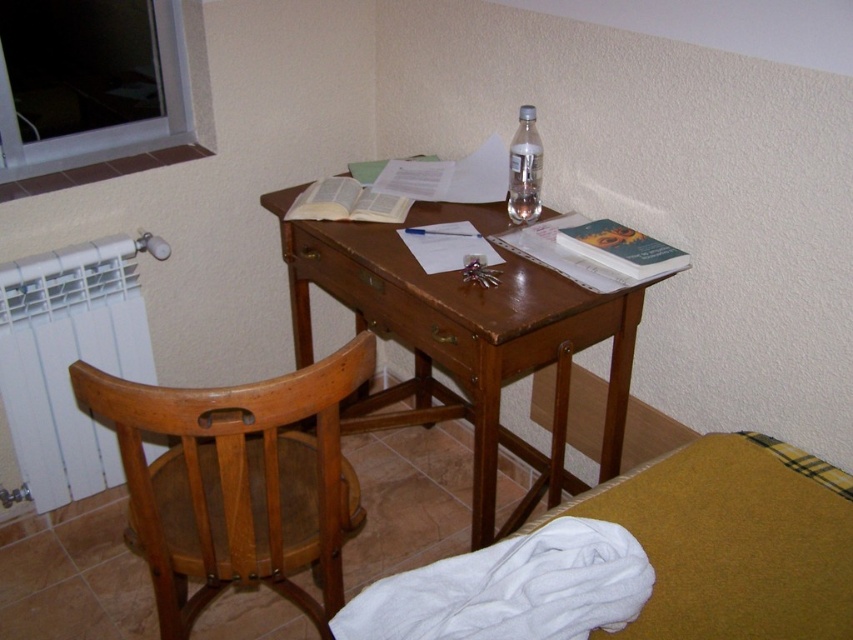
Consider the image. You are a person sitting on the chair to the left of the wooden desk at center. You want to reach the clear glass bottle at center. Can you easily reach it without moving your chair?

The wooden desk at center is in front of the clear glass bottle at center, so the desk is blocking the direct path. You would need to move the chair or the desk to reach the bottle.

You are moving a small potted plant that is 30 cm wide. You want to place it near the desk without blocking the path to the chair. Which object should you place it next to, the white plastic radiator at lower left or the brown wood drawer at center?

The white plastic radiator at lower left has a larger size compared to the brown wood drawer at center, so placing the 30 cm wide potted plant next to the white plastic radiator at lower left would provide enough space and avoid blocking the path to the chair.

You are organizing a small party and need to place a 15 cm tall candle on the wooden desk at center. The clear glass bottle at center is currently occupying space there. Can the candle be placed on the desk without moving the bottle?

The wooden desk at center has a greater height compared to the clear glass bottle at center. Since the candle is 15 cm tall, it can be placed on the desk as long as there is enough space next to or around the bottle, but the height of the desk itself isn